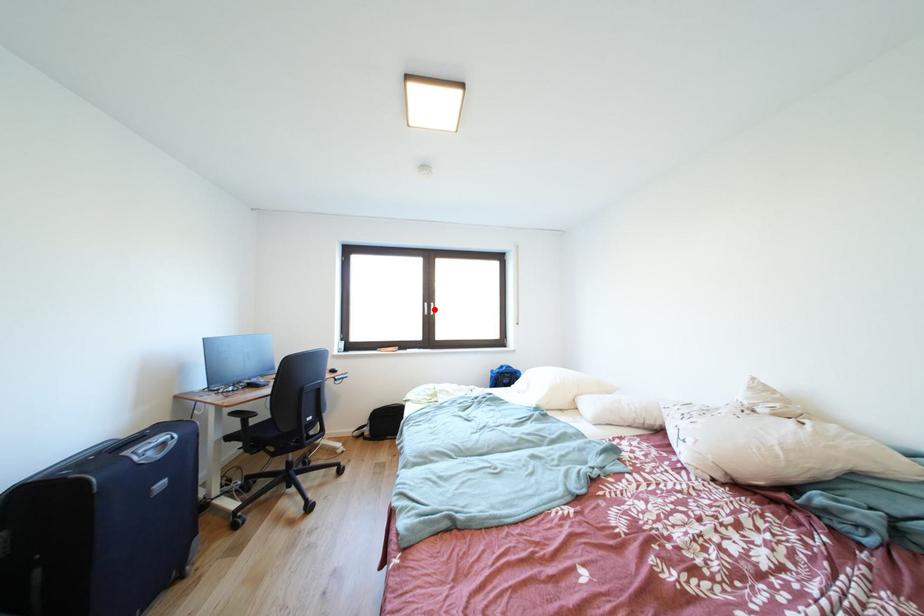
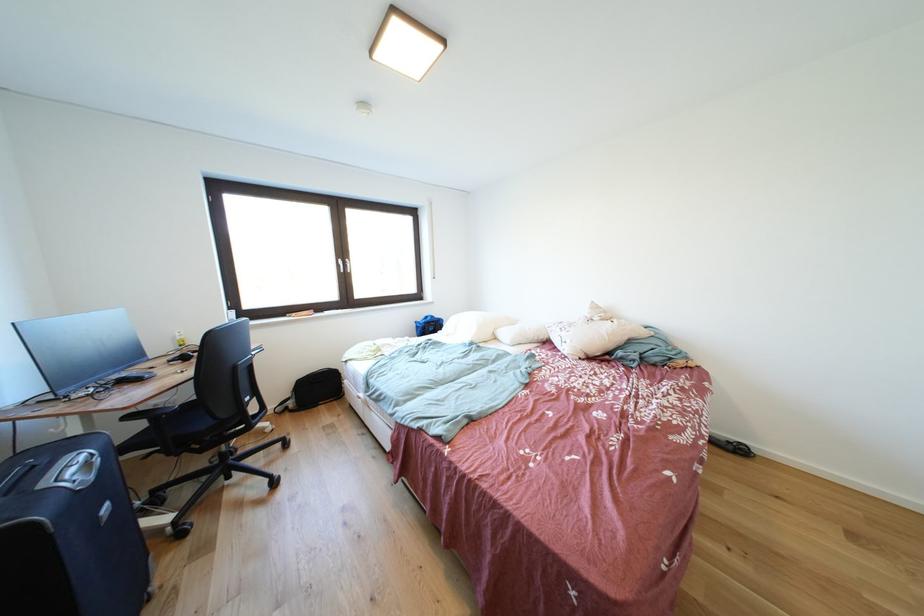
Where in the second image is the point corresponding to the highlighted location from the first image?

(348, 265)